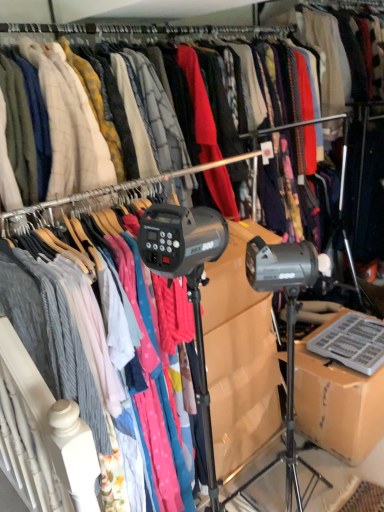
Locate an element on the screen. matte gray sweater at center is located at coordinates coord(49,333).

Image resolution: width=384 pixels, height=512 pixels. Describe the element at coordinates (49, 333) in the screenshot. I see `matte gray sweater at center` at that location.

Describe the element at coordinates (337, 403) in the screenshot. Image resolution: width=384 pixels, height=512 pixels. I see `brown cardboard box at lower right` at that location.

Where is `brown cardboard box at lower right`? brown cardboard box at lower right is located at coordinates (337, 403).

The image size is (384, 512). Identify the location of matte gray sweater at center. (49, 333).

Which object is positioned more to the right, matte gray sweater at center or brown cardboard box at lower right?

brown cardboard box at lower right is more to the right.

Considering the relative positions of matte gray sweater at center and brown cardboard box at lower right in the image provided, is matte gray sweater at center in front of brown cardboard box at lower right?

Yes, the depth of matte gray sweater at center is less than that of brown cardboard box at lower right.

Which is behind, point (74, 366) or point (314, 397)?

The point (314, 397) is behind.

From the image's perspective, which one is positioned lower, matte gray sweater at center or brown cardboard box at lower right?

From the image's view, brown cardboard box at lower right is below.

From the picture: From a real-world perspective, who is located higher, matte gray sweater at center or brown cardboard box at lower right?

In real-world perspective, matte gray sweater at center is above.

Considering the relative sizes of matte gray sweater at center and brown cardboard box at lower right in the image provided, is matte gray sweater at center wider than brown cardboard box at lower right?

Indeed, matte gray sweater at center has a greater width compared to brown cardboard box at lower right.

Can you confirm if matte gray sweater at center is shorter than brown cardboard box at lower right?

No.

Can you confirm if matte gray sweater at center is smaller than brown cardboard box at lower right?

Incorrect, matte gray sweater at center is not smaller in size than brown cardboard box at lower right.

Is matte gray sweater at center spatially inside brown cardboard box at lower right, or outside of it?

matte gray sweater at center is outside brown cardboard box at lower right.

Can you see matte gray sweater at center touching brown cardboard box at lower right?

matte gray sweater at center is not next to brown cardboard box at lower right, and they're not touching.

Is matte gray sweater at center facing towards brown cardboard box at lower right?

No, matte gray sweater at center is not turned towards brown cardboard box at lower right.

Locate an element on the screen. The width and height of the screenshot is (384, 512). cardboard box behind the matte gray sweater at center is located at coordinates (337, 403).

Would you say brown cardboard box at lower right is to the left or to the right of matte gray sweater at center in the picture?

In the image, brown cardboard box at lower right appears on the right side of matte gray sweater at center.

Considering the positions of objects brown cardboard box at lower right and matte gray sweater at center in the image provided, who is in front, brown cardboard box at lower right or matte gray sweater at center?

matte gray sweater at center is in front.

Is point (345, 429) behind point (102, 440)?

Yes, it is.

From the image's perspective, which object appears higher, brown cardboard box at lower right or matte gray sweater at center?

matte gray sweater at center, from the image's perspective.

In the scene shown: From a real-world perspective, is brown cardboard box at lower right positioned under matte gray sweater at center based on gravity?

Yes.

Does brown cardboard box at lower right have a lesser width compared to matte gray sweater at center?

Yes.

Between brown cardboard box at lower right and matte gray sweater at center, which one has more height?

matte gray sweater at center.

Can you confirm if brown cardboard box at lower right is smaller than matte gray sweater at center?

Yes.

Would you say brown cardboard box at lower right contains matte gray sweater at center?

No, matte gray sweater at center is not a part of brown cardboard box at lower right.

Is the surface of brown cardboard box at lower right in direct contact with matte gray sweater at center?

There is a gap between brown cardboard box at lower right and matte gray sweater at center.

Does brown cardboard box at lower right turn towards matte gray sweater at center?

No.

How many degrees apart are the facing directions of brown cardboard box at lower right and matte gray sweater at center?

0.726 degrees separate the facing orientations of brown cardboard box at lower right and matte gray sweater at center.

Measure the distance from brown cardboard box at lower right to matte gray sweater at center.

1.04 meters.

The image size is (384, 512). Identify the location of cardboard box on the right side of matte gray sweater at center. (337, 403).

This screenshot has height=512, width=384. In the image, there is a matte gray sweater at center. Identify the location of cardboard box below it (from the image's perspective). (337, 403).

I want to click on clothing above the brown cardboard box at lower right (from the image's perspective), so click(x=49, y=333).